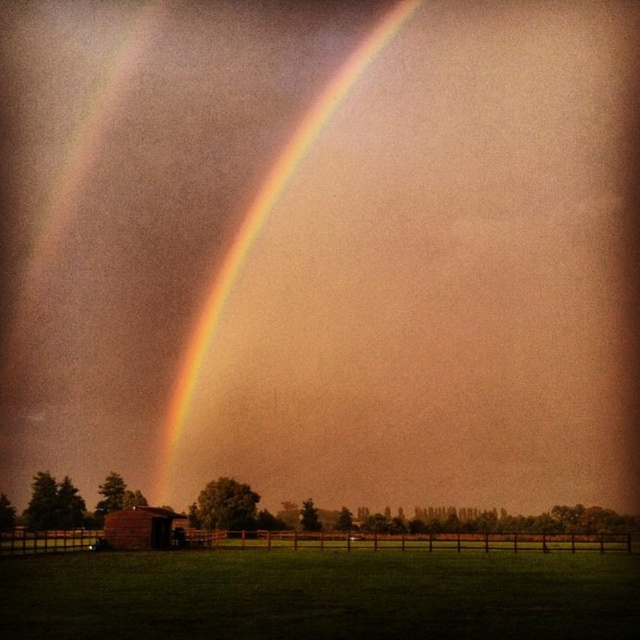
You are standing in the middle of the field and see the green grass at lower center and the rainbow at upper center. Which object is closer to the ground?

The green grass at lower center is closer to the ground because it is located below the rainbow at upper center.

You are a gardener planning to plant flowers in the green grass at lower center and the brown brick barn at lower left. Which area has a larger space available for planting?

The green grass at lower center has a larger space available for planting since its width is greater than that of the brown brick barn at lower left.